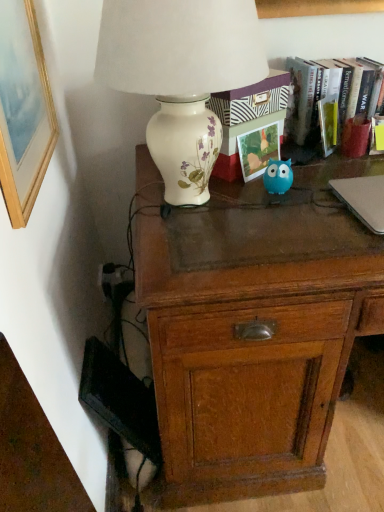
Question: Based on their positions, is wooden picture frame at upper left located to the left or right of silver metallic laptop at right?

Choices:
 (A) left
 (B) right

Answer: (A)

Question: Considering the positions of wooden picture frame at upper left and silver metallic laptop at right in the image, is wooden picture frame at upper left taller or shorter than silver metallic laptop at right?

Choices:
 (A) short
 (B) tall

Answer: (B)

Question: Which is nearer to the wooden desk at center?

Choices:
 (A) silver metallic laptop at right
 (B) wooden picture frame at upper left
 (C) hardcover book at upper right
 (D) matte paper photo frame at center
 (E) porcelain floral lamp at upper left

Answer: (E)

Question: Considering the real-world distances, which object is farthest from the blue rubber toy at center?

Choices:
 (A) silver metallic laptop at right
 (B) wooden desk at center
 (C) matte paper photo frame at center
 (D) wooden picture frame at upper left
 (E) porcelain floral lamp at upper left

Answer: (D)